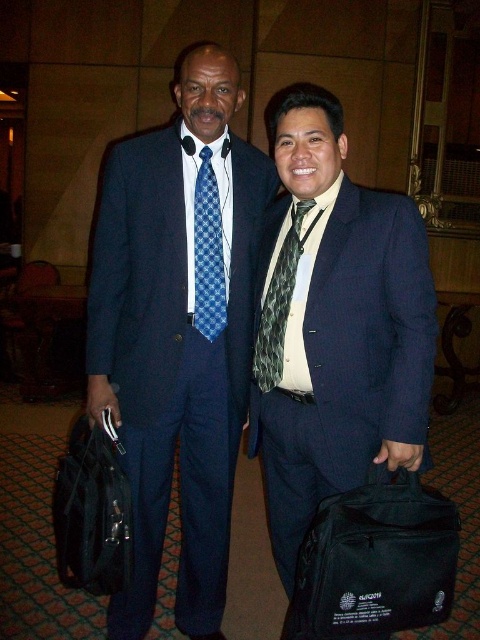
Question: Which point is farther to the camera?

Choices:
 (A) (446, 570)
 (B) (86, 538)
 (C) (273, 340)

Answer: (C)

Question: Which object is the farthest from the matte black suit at center?

Choices:
 (A) black fabric bag at lower right
 (B) black fabric bag at lower left
 (C) green textured tie at center
 (D) blue checkered tie at center

Answer: (B)

Question: Is black fabric bag at lower right thinner than black fabric bag at lower left?

Choices:
 (A) yes
 (B) no

Answer: (B)

Question: Does blue checkered tie at center appear under green textured tie at center?

Choices:
 (A) yes
 (B) no

Answer: (B)

Question: Which point is farther to the camera?

Choices:
 (A) (86, 557)
 (B) (283, 352)
 (C) (377, 500)
 (D) (210, 61)

Answer: (D)

Question: Is matte blue suit at center to the left of black fabric bag at lower right from the viewer's perspective?

Choices:
 (A) yes
 (B) no

Answer: (A)